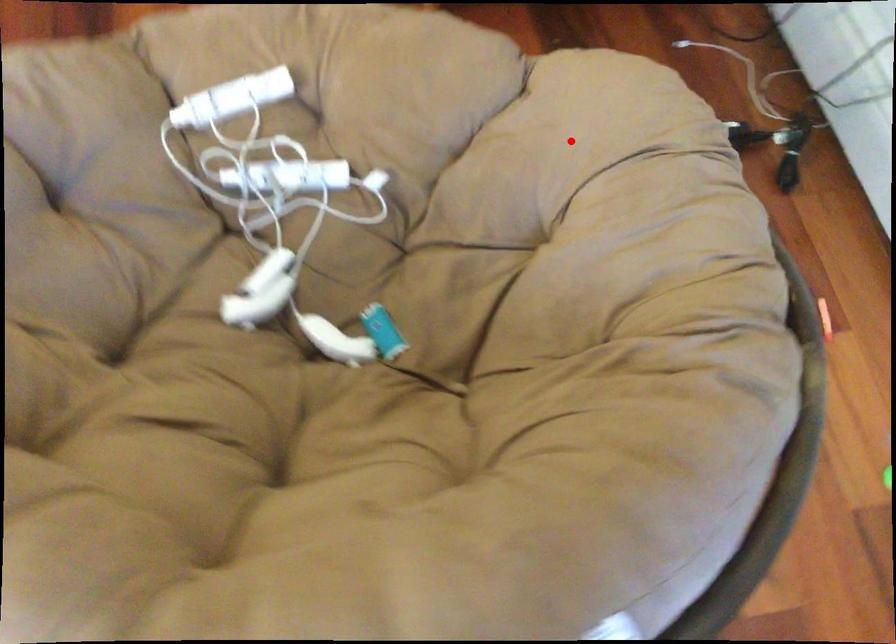
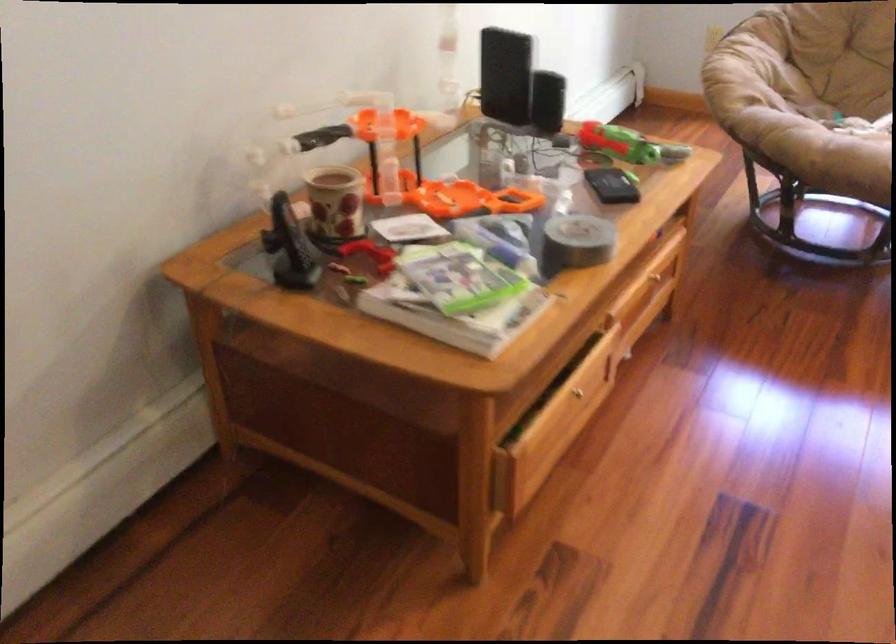
Question: I am providing you with two images of the same scene from different viewpoints. In image1, a red point is highlighted. Considering the same 3D point in image2, which of the following is correct?

Choices:
 (A) It is closer
 (B) It is farther

Answer: (B)